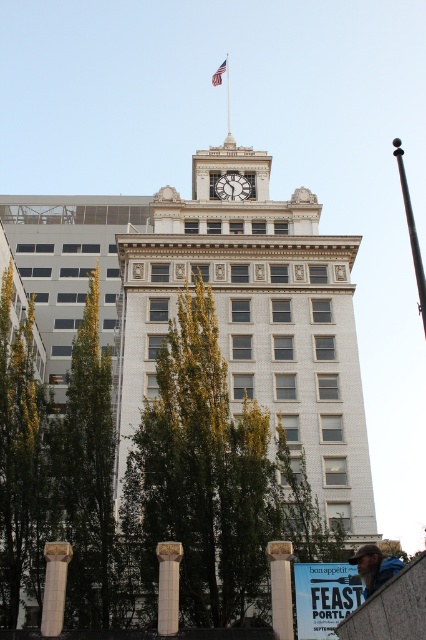
Question: In this image, where is white marble column at lower center located relative to white glossy clock at upper center?

Choices:
 (A) right
 (B) left

Answer: (B)

Question: Does white marble column at lower center appear under metallic flag pole at upper center?

Choices:
 (A) yes
 (B) no

Answer: (A)

Question: Considering the real-world distances, which object is closest to the metallic flag pole at upper center?

Choices:
 (A) white glossy clock at upper center
 (B) green leafy tree at lower left
 (C) white stone column at lower center
 (D) white marble column at lower left

Answer: (A)

Question: Among these points, which one is farthest from the camera?

Choices:
 (A) (69, 557)
 (B) (227, 61)

Answer: (B)

Question: Which of the following is the farthest from the observer?

Choices:
 (A) (281, 568)
 (B) (230, 131)

Answer: (B)

Question: Can you confirm if green leafy tree at lower left is thinner than white stone column at lower center?

Choices:
 (A) no
 (B) yes

Answer: (A)